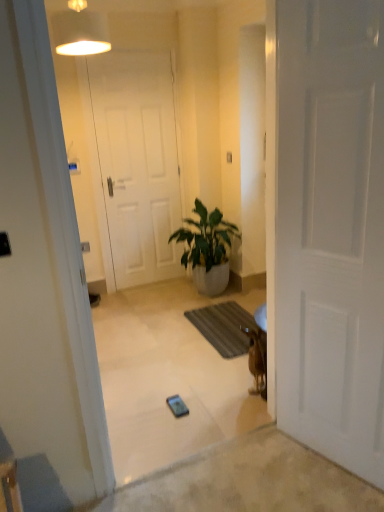
Image resolution: width=384 pixels, height=512 pixels. I want to click on vacant area situated below white fabric lampshade at upper center (from a real-world perspective), so click(120, 345).